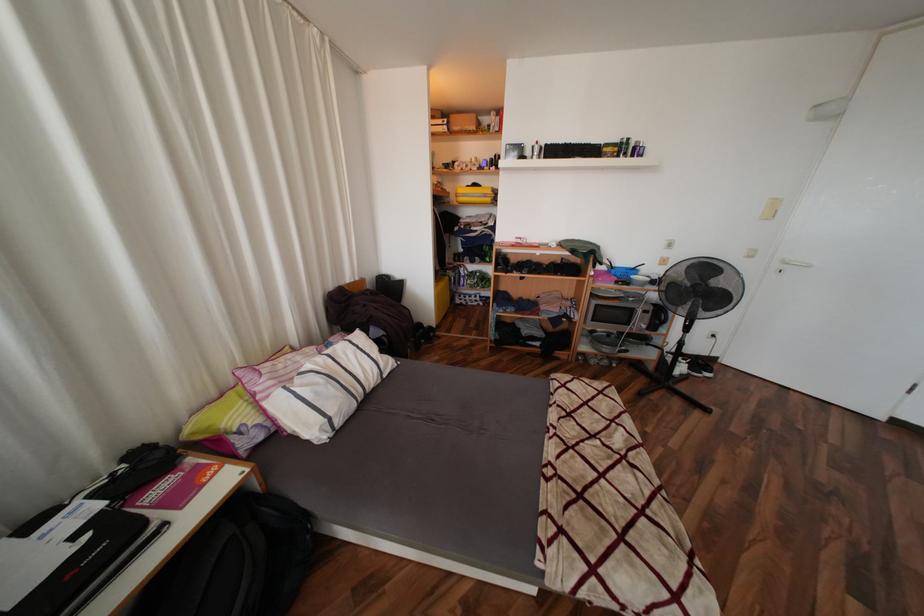
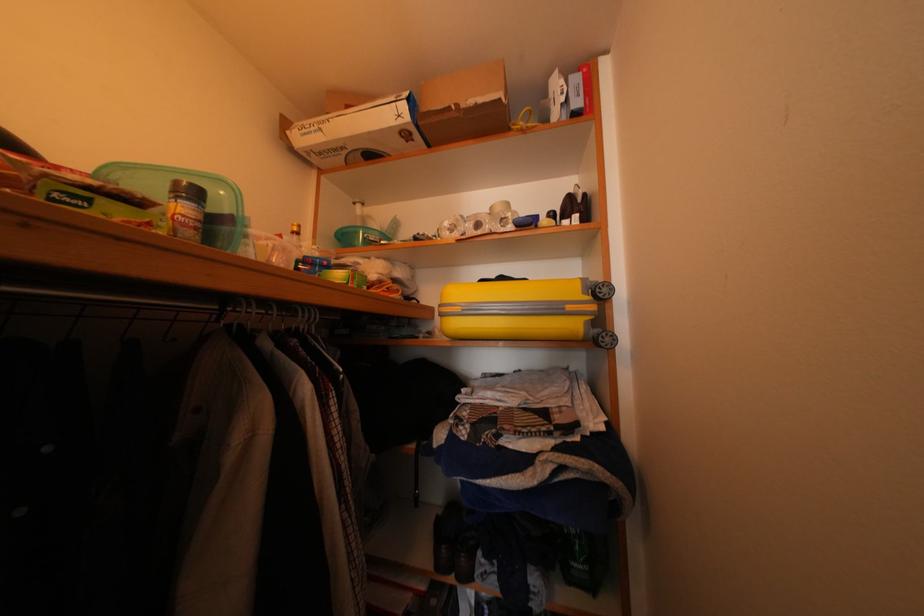
Question: What movement of the cameraman would produce the second image?

Choices:
 (A) Left
 (B) Right
 (C) Forward
 (D) Backward

Answer: (C)